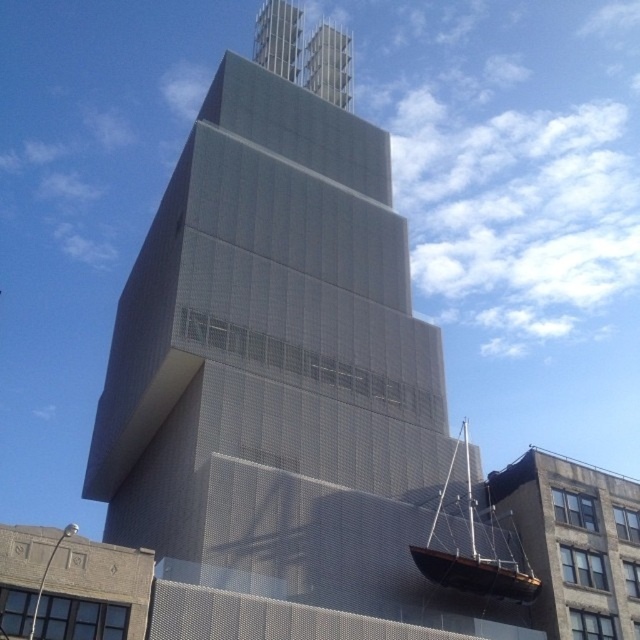
You are standing at the origin point in the image. There are two points marked in the scene, point (385, 179) and point (470, 548). Which of these points is closer to you?

Point (470, 548) is closer to you because it is in front of point (385, 179).

What is located at the coordinates point (291, 392) in the image?

At point (291, 392) lies gray metallic building at center.